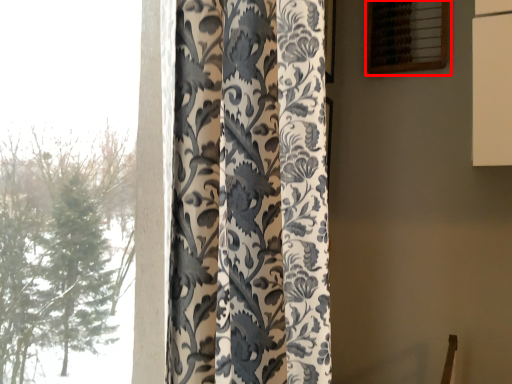
Question: From the image's perspective, where is window (annotated by the red box) located in relation to curtain in the image?

Choices:
 (A) below
 (B) above

Answer: (B)